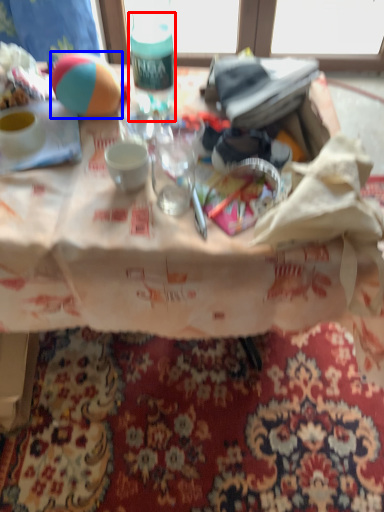
Question: Which of the following is the farthest to the observer, bottle (highlighted by a red box) or ball (highlighted by a blue box)?

Choices:
 (A) bottle
 (B) ball

Answer: (B)